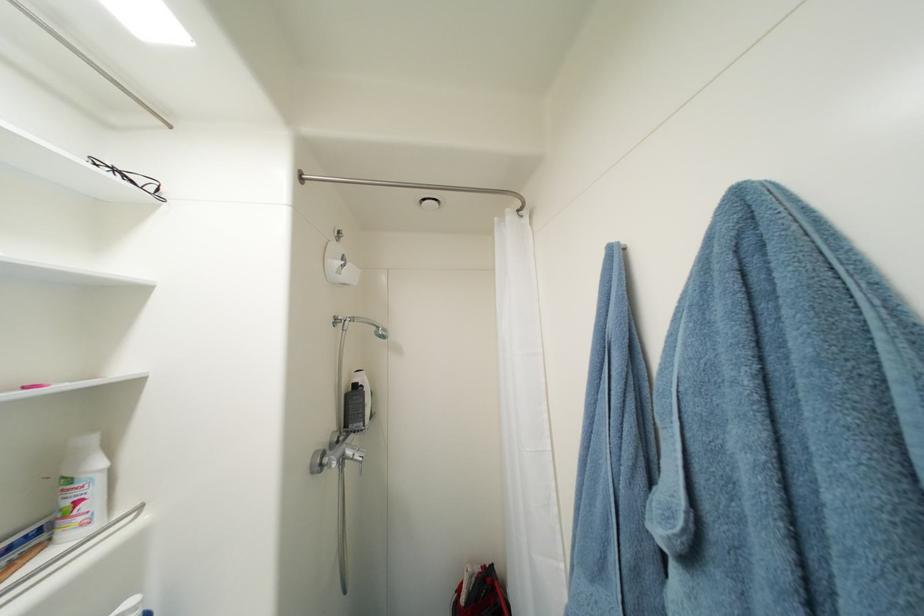
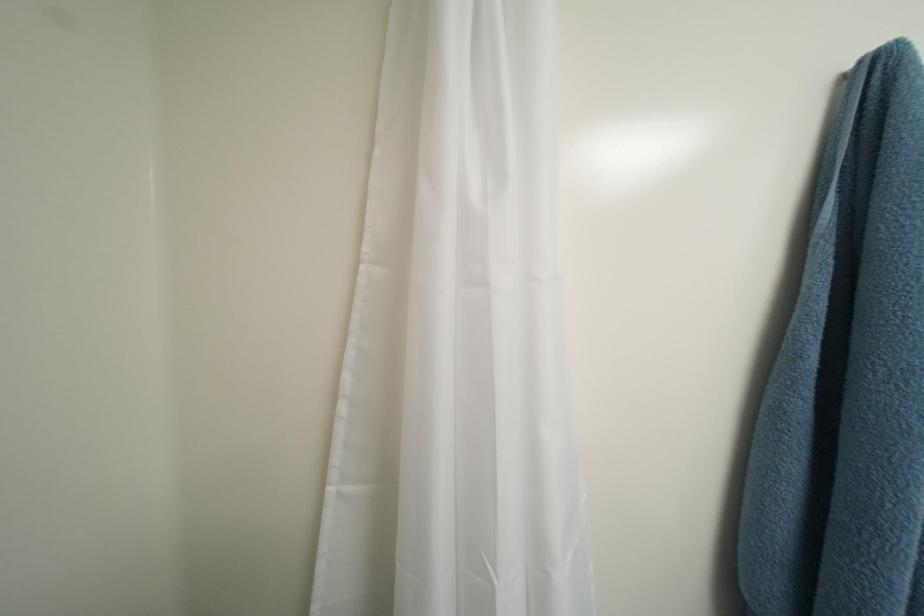
Question: The images are taken continuously from a first-person perspective. In which direction is your viewpoint rotating?

Choices:
 (A) Left
 (B) Right
 (C) Up
 (D) Down

Answer: (B)